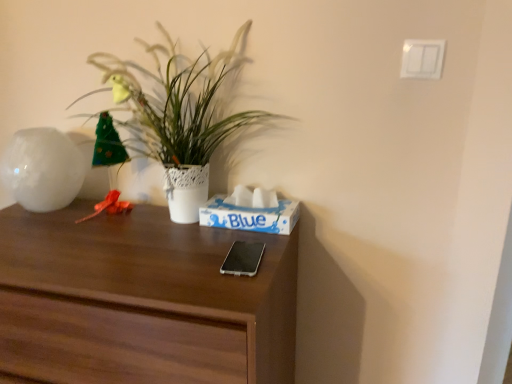
This screenshot has width=512, height=384. In order to click on vacant space in between silver metallic phone at center and blue paper tissue box at center in this screenshot , I will do `click(237, 240)`.